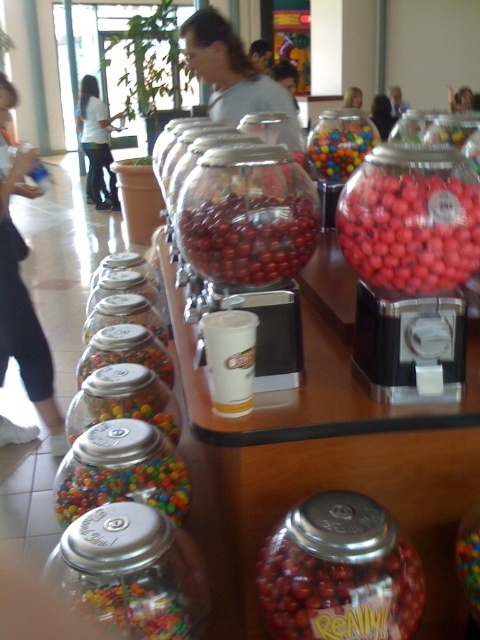
Question: Which object is the farthest from the white cotton shirt at upper left?

Choices:
 (A) rubberized red gumballs at center
 (B) white fabric shirt at upper left

Answer: (A)

Question: Can you confirm if multicolored glass jar at center is thinner than shiny red gumballs at center?

Choices:
 (A) yes
 (B) no

Answer: (A)

Question: Considering the real-world distances, which object is closest to the matte gray shirt at upper center?

Choices:
 (A) multicolored glass jar at center
 (B) brown hair at upper center
 (C) smooth skin face at upper center

Answer: (B)

Question: Can you confirm if translucent plastic gumballs at lower left is thinner than multicolored glossy gumballs at center?

Choices:
 (A) yes
 (B) no

Answer: (A)

Question: Is translucent plastic gumballs at lower left positioned in front of smooth skin face at upper center?

Choices:
 (A) no
 (B) yes

Answer: (B)

Question: Which of these objects is positioned farthest from the translucent plastic jar at center?

Choices:
 (A) smooth skin face at upper right
 (B) white cotton shirt at upper left
 (C) rubberized red gumballs at center

Answer: (A)